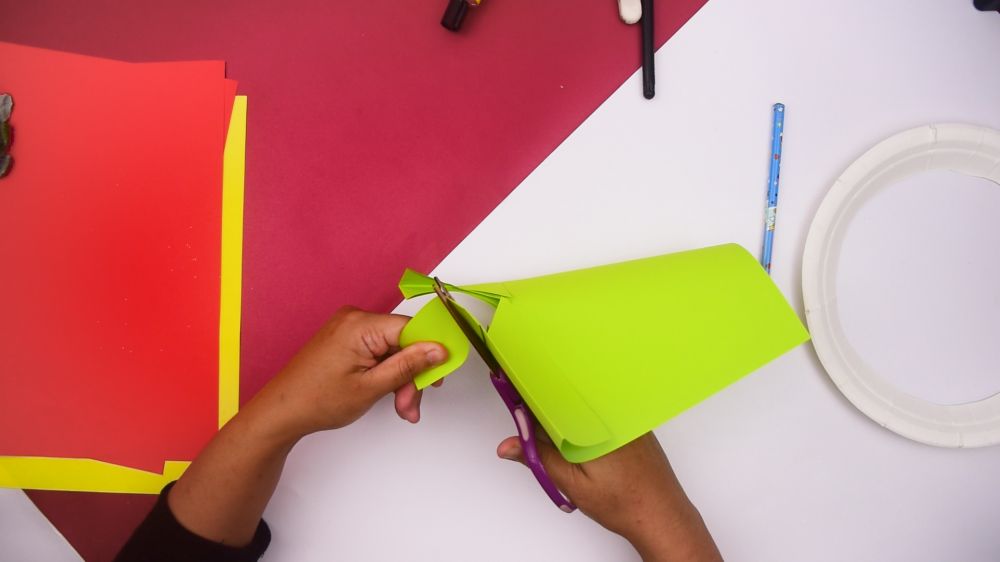
This screenshot has height=562, width=1000. I want to click on border between red and white sides of table, so click(x=536, y=167).